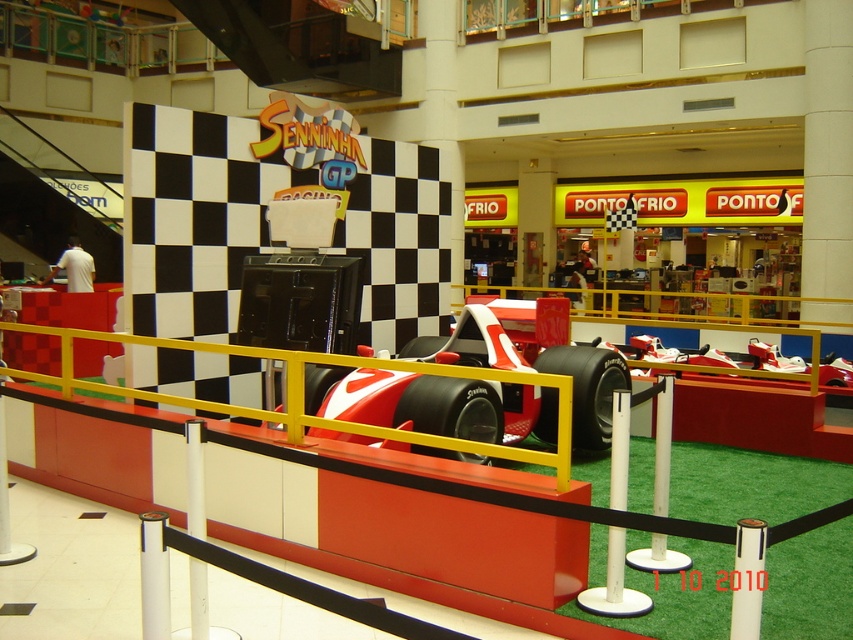
Does point (428, 346) lie in front of point (193, 637)?

No, it is not.

Is red matte race car at center positioned in front of white plastic pole at center?

No, red matte race car at center is further to the viewer.

Which is in front, point (376, 385) or point (202, 497)?

Point (202, 497) is in front.

At what (x,y) coordinates should I click in order to perform the action: click on red matte race car at center. Please return your answer as a coordinate pair (x, y). The image size is (853, 640). Looking at the image, I should click on (439, 404).